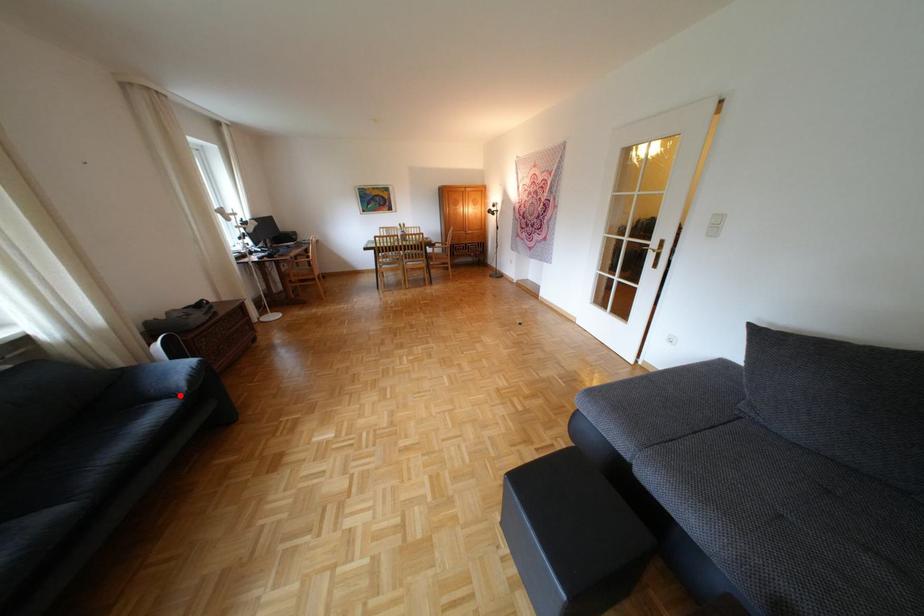
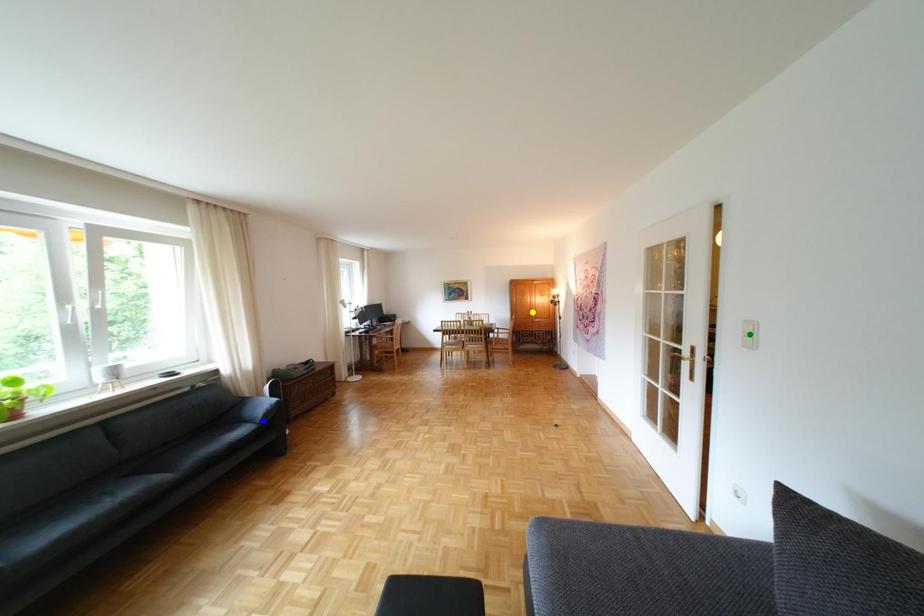
Question: I am providing you with two images of the same scene from different viewpoints. A red point is marked on the first image. You are given multiple points on the second image. Which mark in image 2 goes with the point in image 1?

Choices:
 (A) green point
 (B) blue point
 (C) yellow point

Answer: (B)